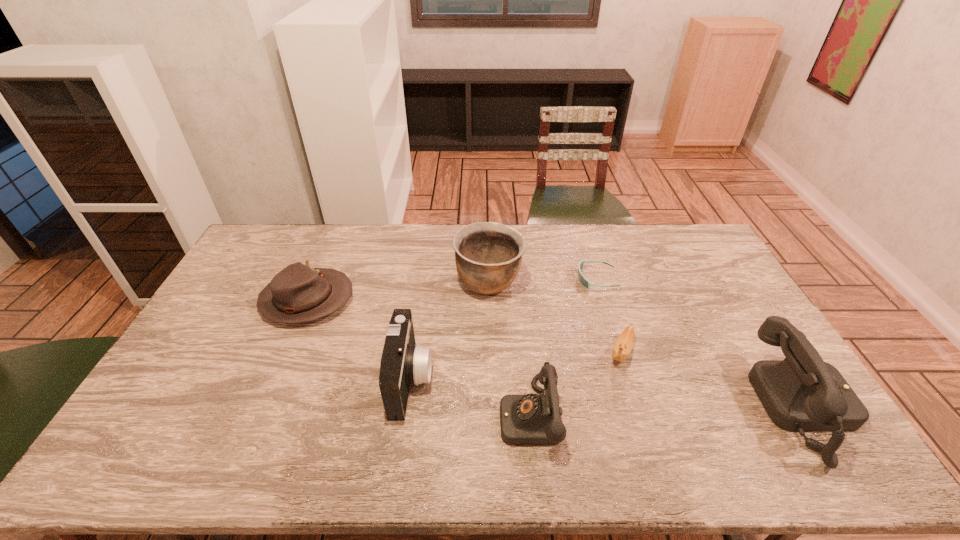
Please point a spot to add another telephone on the left. Please provide its 2D coordinates. Your answer should be formatted as a tuple, i.e. [(x, y)], where the tuple contains the x and y coordinates of a point satisfying the conditions above.

[(243, 425)]